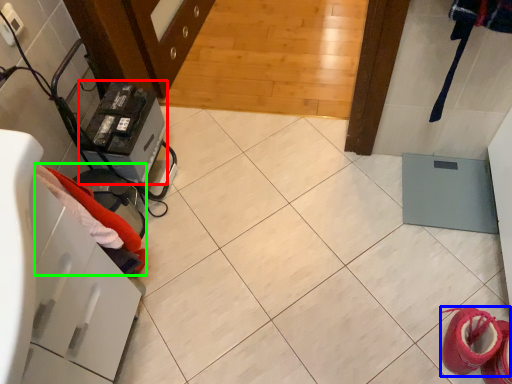
Question: Based on their relative distances, which object is nearer to appliance (highlighted by a red box)? Choose from footwear (highlighted by a blue box) and clothing (highlighted by a green box).

Choices:
 (A) footwear
 (B) clothing

Answer: (B)